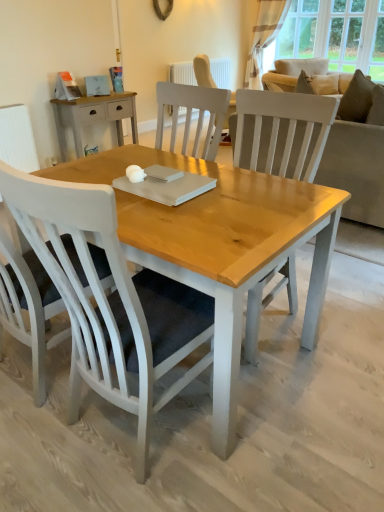
This screenshot has width=384, height=512. Find the location of `free area below white painted wood chair at center, arranged as the 1th chair when viewed from the right (from a real-world perspective)`. free area below white painted wood chair at center, arranged as the 1th chair when viewed from the right (from a real-world perspective) is located at coordinates (134, 428).